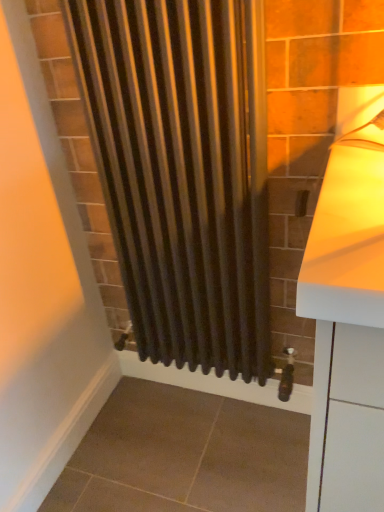
The height and width of the screenshot is (512, 384). Identify the location of matte black radiator at center. (183, 170).

The width and height of the screenshot is (384, 512). What do you see at coordinates (183, 170) in the screenshot?
I see `matte black radiator at center` at bounding box center [183, 170].

Measure the distance between point (193, 348) and camera.

Point (193, 348) is 4.40 feet from camera.

Image resolution: width=384 pixels, height=512 pixels. I want to click on matte black radiator at center, so click(x=183, y=170).